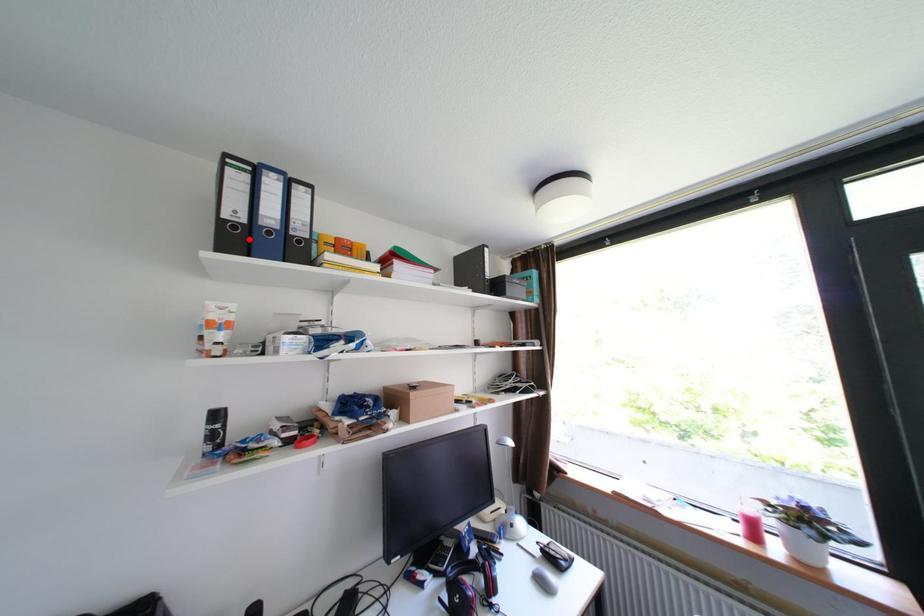
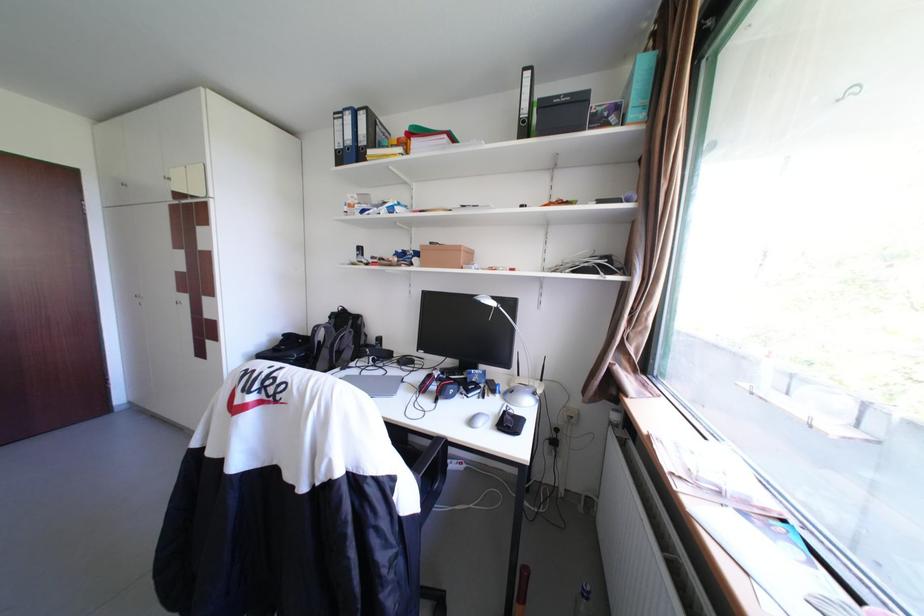
Where in the second image is the point corresponding to the highlighted location from the first image?

(351, 158)